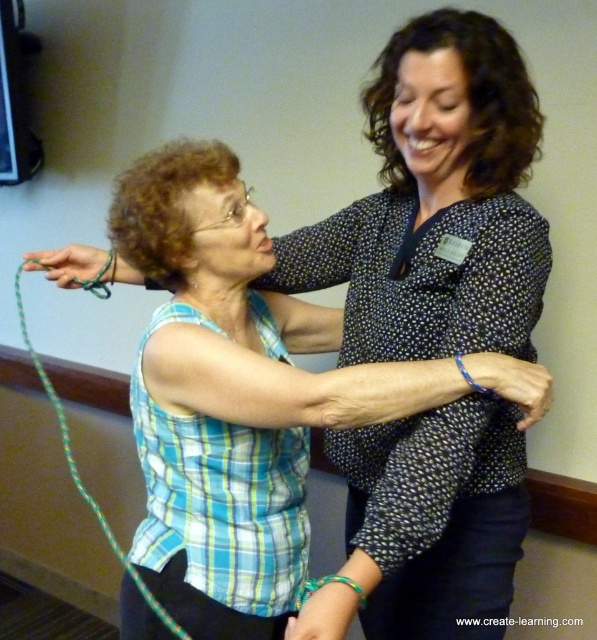
Is blue woven bracelet at center below matte green rope at upper left?

Correct, blue woven bracelet at center is located below matte green rope at upper left.

Is point (373, 390) farther from viewer compared to point (103, 262)?

No, it is in front of (103, 262).

Find the location of a particular element. This screenshot has height=640, width=597. blue woven bracelet at center is located at coordinates (285, 385).

Is point (485, 353) farther from camera compared to point (96, 516)?

No, (485, 353) is closer to viewer.

Is blue woven bracelet at center in front of green braided string at left?

Yes.

Does point (269, 410) lie in front of point (152, 604)?

That is True.

I want to click on blue woven bracelet at center, so click(x=285, y=385).

Locate an element on the screen. This screenshot has width=597, height=640. matte green rope at upper left is located at coordinates (312, 253).

Can you confirm if matte green rope at upper left is wider than green braided string at left?

Correct, the width of matte green rope at upper left exceeds that of green braided string at left.

Identify the location of matte green rope at upper left. The image size is (597, 640). (312, 253).

Locate an element on the screen. matte green rope at upper left is located at coordinates (312, 253).